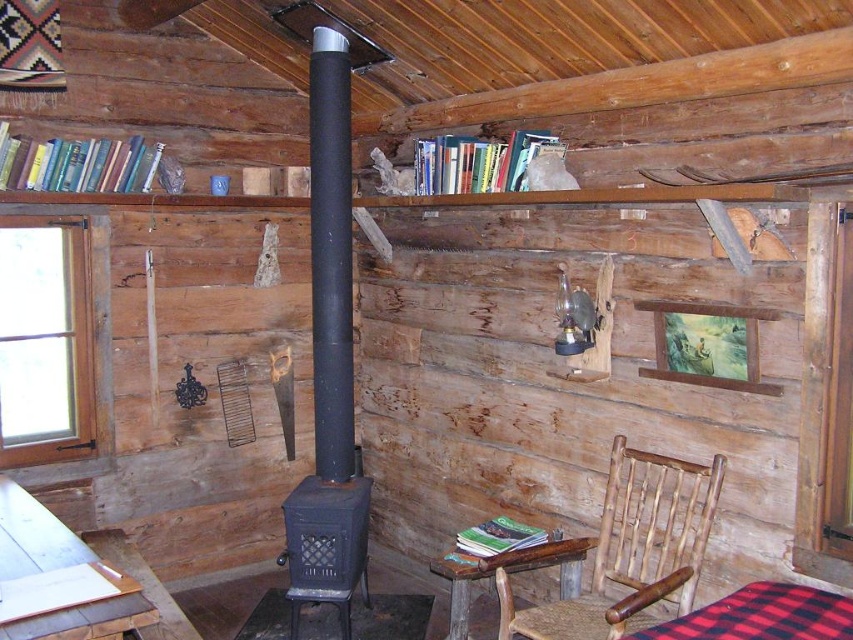
You are sitting in the woven wood chair at lower right and want to reach the rustic wood table at lower center to grab a book. Is the table within your immediate reach without moving from the chair?

The woven wood chair at lower right is in front of rustic wood table at lower center, so yes, the table is within immediate reach since the chair is positioned directly in front of it.

You are organizing a small gathering in the cabin and need to place a 1.2 meter long tablecloth. The red plaid fabric at lower right and the rustic wood table at lower center are available. Which object can the tablecloth fit over without hanging off the edges?

The rustic wood table at lower center is taller than the red plaid fabric at lower right, so the tablecloth would fit better on the rustic wood table at lower center since it has a larger surface area.

You are a guest in this cabin and want to sit down. You see a woven wood chair at lower right and a red plaid fabric at lower right. Which one is bigger and can you sit on the red plaid fabric?

The woven wood chair at lower right is larger in size than the red plaid fabric at lower right. Since the red plaid fabric at lower right is smaller, it might not be suitable for sitting comfortably, but you could still sit on it if desired.